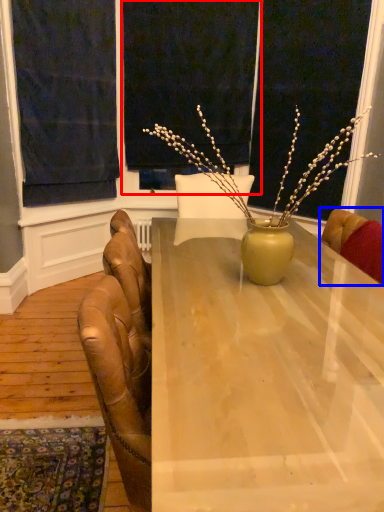
Question: Which point is closer to the camera, window screen (highlighted by a red box) or chair (highlighted by a blue box)?

Choices:
 (A) window screen
 (B) chair

Answer: (B)